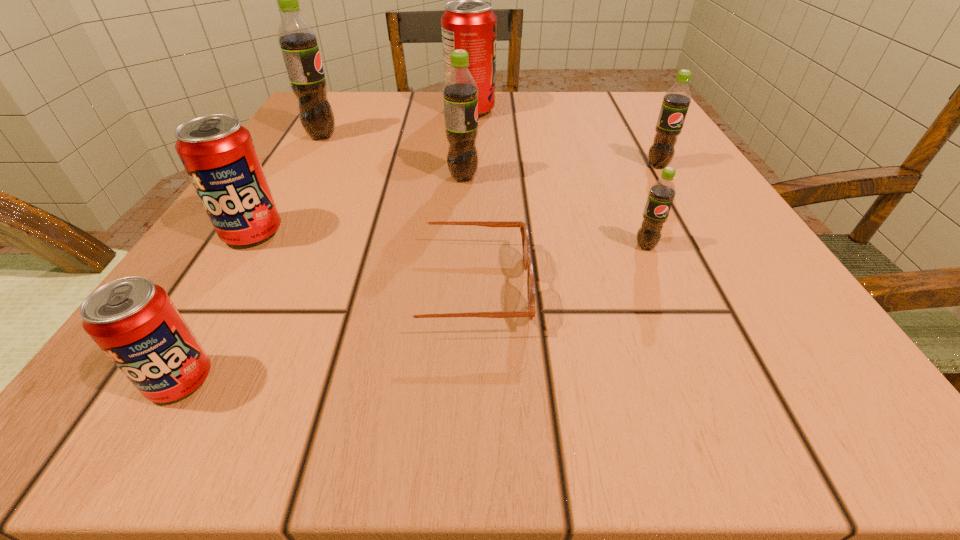
Locate an element on the screen. The height and width of the screenshot is (540, 960). free spot located on the back of the nearest soda can is located at coordinates (303, 168).

Find the location of a particular element. This screenshot has height=540, width=960. vacant area located 0.060m on the front-facing side of the sunglasses is located at coordinates (577, 287).

Image resolution: width=960 pixels, height=540 pixels. I want to click on object that is at the near edge, so click(135, 323).

This screenshot has height=540, width=960. In order to click on object that is at the far left corner in this screenshot , I will do `click(299, 44)`.

Locate an element on the screen. The width and height of the screenshot is (960, 540). object located in the near left corner section of the desktop is located at coordinates (135, 323).

You are a GUI agent. You are given a task and a screenshot of the screen. Output one action in this format:
    pyautogui.click(x=<x>, y=<y>)
    Task: Click on the vacant point at the far edge
    The image size is (960, 540).
    Given the screenshot: What is the action you would take?
    pyautogui.click(x=534, y=108)

Where is `vacant position at the left edge of the desktop`? vacant position at the left edge of the desktop is located at coordinates (356, 165).

Image resolution: width=960 pixels, height=540 pixels. Identify the location of free region at the right edge of the desktop. (662, 270).

At what (x,y) coordinates should I click in order to perform the action: click on free space at the far left corner of the desktop. Please return your answer as a coordinate pair (x, y). This screenshot has height=540, width=960. Looking at the image, I should click on (312, 139).

Find the location of a particular element. Image resolution: width=960 pixels, height=540 pixels. vacant space at the near left corner of the desktop is located at coordinates (137, 417).